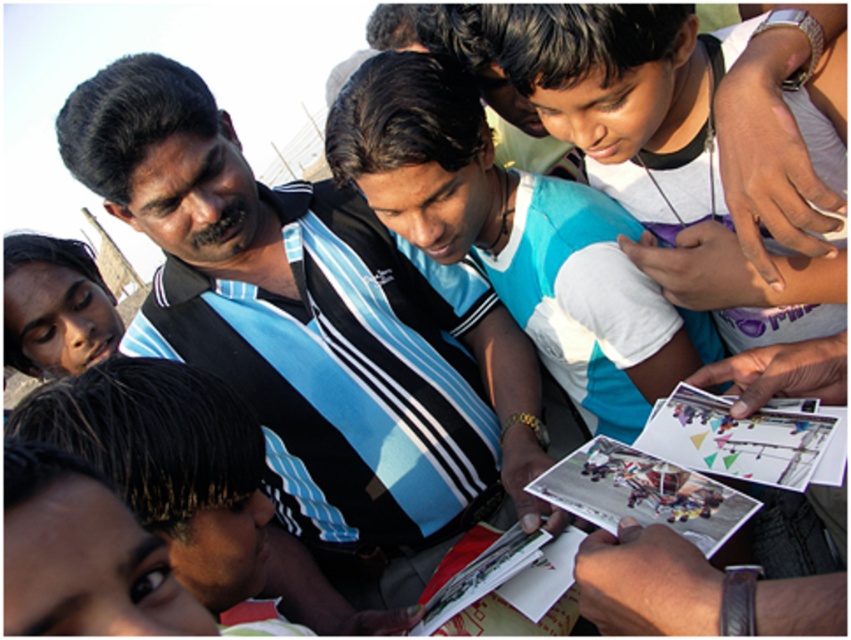
Who is higher up, black striped shirt at center or printed paper postcards at center?

black striped shirt at center is above.

Is point (497, 400) positioned before point (721, 417)?

No, it is not.

Identify the location of black striped shirt at center. (317, 336).

Between point (527, 468) and point (570, 508), which one is positioned in front?

Point (570, 508) is more forward.

Does black striped shirt at center have a lesser width compared to printed paper postcard at center?

No, black striped shirt at center is not thinner than printed paper postcard at center.

Identify the location of black striped shirt at center. (317, 336).

Between printed paper postcards at center and printed paper postcard at center, which one has more height?

printed paper postcard at center is taller.

Is point (797, 449) positioned in front of point (718, 486)?

Yes, point (797, 449) is in front of point (718, 486).

Which is in front, point (711, 444) or point (707, 536)?

Positioned in front is point (707, 536).

The image size is (851, 640). What are the coordinates of `printed paper postcards at center` in the screenshot? It's located at (747, 440).